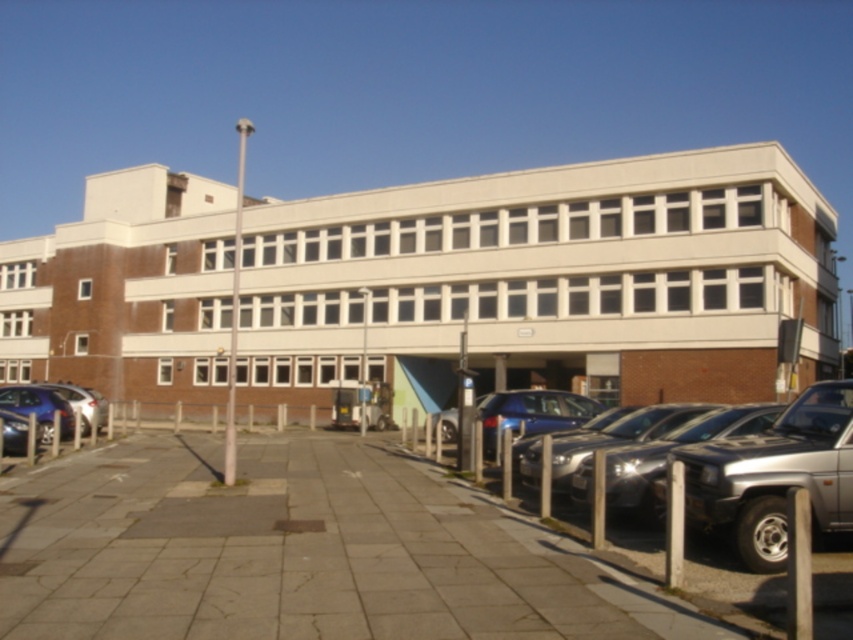
Is silver metallic suv at right wider than shiny blue sedan at left?

No, silver metallic suv at right is not wider than shiny blue sedan at left.

Which is in front, point (764, 518) or point (26, 401)?

Point (764, 518) is more forward.

Between point (683, 454) and point (4, 404), which one is positioned behind?

Point (4, 404)

Identify the location of silver metallic suv at right. tap(776, 476).

Does point (816, 433) come closer to viewer compared to point (91, 400)?

That is True.

Looking at this image, between silver metallic suv at right and matte silver car at left, which one is positioned higher?

silver metallic suv at right is above.

Is point (851, 388) in front of point (85, 433)?

Yes, it is in front of point (85, 433).

Find the location of `silver metallic suv at right`. silver metallic suv at right is located at coordinates (776, 476).

Does silver metallic car at center right lie behind silver metallic suv at right?

Yes, silver metallic car at center right is further from the viewer.

Which is more to the left, silver metallic car at center right or silver metallic suv at right?

silver metallic car at center right

Find the location of a particular element. silver metallic car at center right is located at coordinates (775, 476).

At what (x,y) coordinates should I click in order to perform the action: click on silver metallic car at center right. Please return your answer as a coordinate pair (x, y). Looking at the image, I should click on (775, 476).